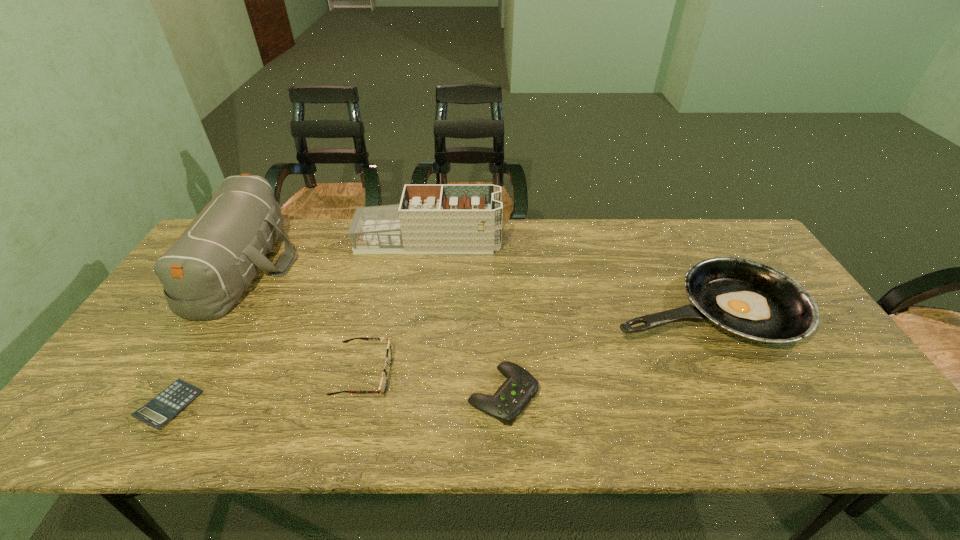
Find the location of `the tallest object`. the tallest object is located at coordinates (204, 273).

Identify the location of the second tallest object. This screenshot has width=960, height=540. (431, 218).

Locate an element on the screen. This screenshot has width=960, height=540. the rightmost object is located at coordinates (747, 299).

Find the location of `frying pan`. frying pan is located at coordinates (747, 299).

Where is `the third shortest object`? Image resolution: width=960 pixels, height=540 pixels. the third shortest object is located at coordinates (384, 379).

Where is `control`? The image size is (960, 540). control is located at coordinates (512, 397).

I want to click on calculator, so click(165, 406).

Locate an element on the screen. This screenshot has width=960, height=540. vacant space located 0.210m on the front of the tallest object is located at coordinates (168, 393).

The height and width of the screenshot is (540, 960). In order to click on free space located at the entrance of the fifth shortest object in this screenshot , I will do `click(549, 241)`.

Identify the location of free space located 0.270m on the left of the rightmost object. The image size is (960, 540). (510, 309).